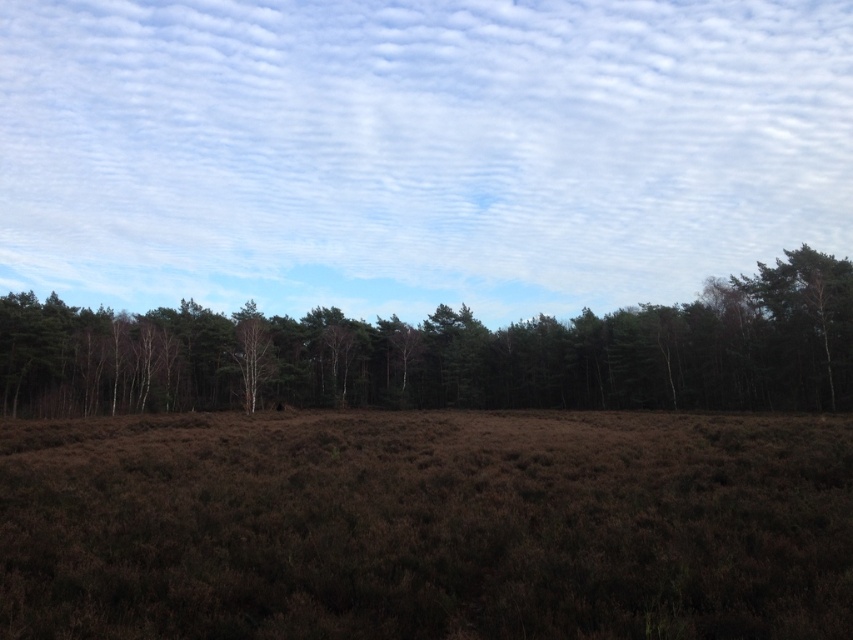
You are a hiker standing at the edge of the brown grassland at center and looking towards the white bark tree at center. Which object is closer to you?

The brown grassland at center is closer to you since it is in front of the white bark tree at center.

You are planning to take a photo of the brown grassland at center. You want to ensure the white fluffy cloud at upper center doesn not block the view. Is the cloud wider than the grassland?

The white fluffy cloud at upper center might be wider than brown grassland at center, so there is a possibility that it could block the view. To avoid obstruction, position the camera so the cloud is out of the frame or adjust the angle to capture the grassland without the cloud overlapping.